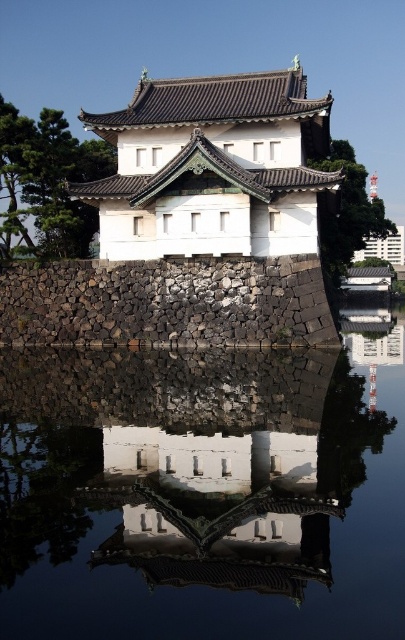
You are standing at the point indicated by point (211, 168) in the image of the Japanese building. What structure are you facing?

The point (211, 168) indicates the white stone building at center, so you are facing the white stone building at center.

You are an architect designing a new garden layout. You need to place a decorative fountain between the white stone building at center and the black stone wall at center. Based on their widths, which side of the fountain should be closer to the building?

The white stone building at center might be wider than black stone wall at center, so the fountain should be placed closer to the black stone wall at center to balance the design.

You are an architect designing a model of this scene. You have to place the transparent glass water at center and the white stone building at center on your model. Which object should be placed first if you want to ensure the smaller one is positioned accurately relative to the larger one?

The transparent glass water at center should be placed first because it is smaller than the white stone building at center, allowing you to position it accurately relative to the larger structure.